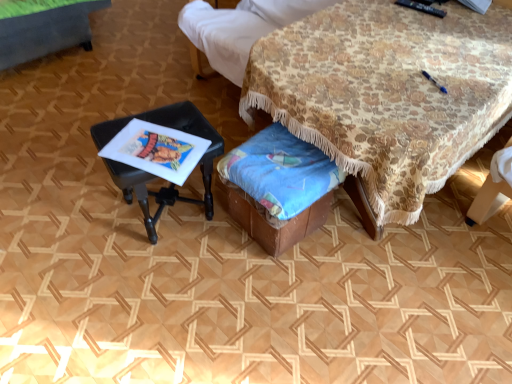
Where is `blank space situated above black plastic stool at left, arranged as the 1th table when viewed from the left (from a real-world perspective)`? The image size is (512, 384). blank space situated above black plastic stool at left, arranged as the 1th table when viewed from the left (from a real-world perspective) is located at coordinates (x=159, y=130).